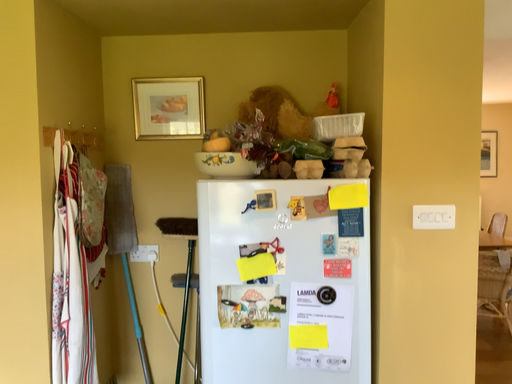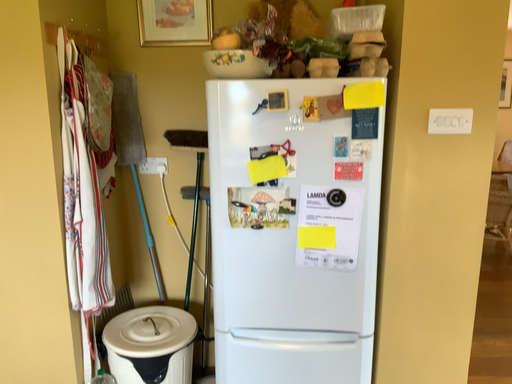
Question: How did the camera likely rotate when shooting the video?

Choices:
 (A) rotated upward
 (B) rotated downward

Answer: (B)